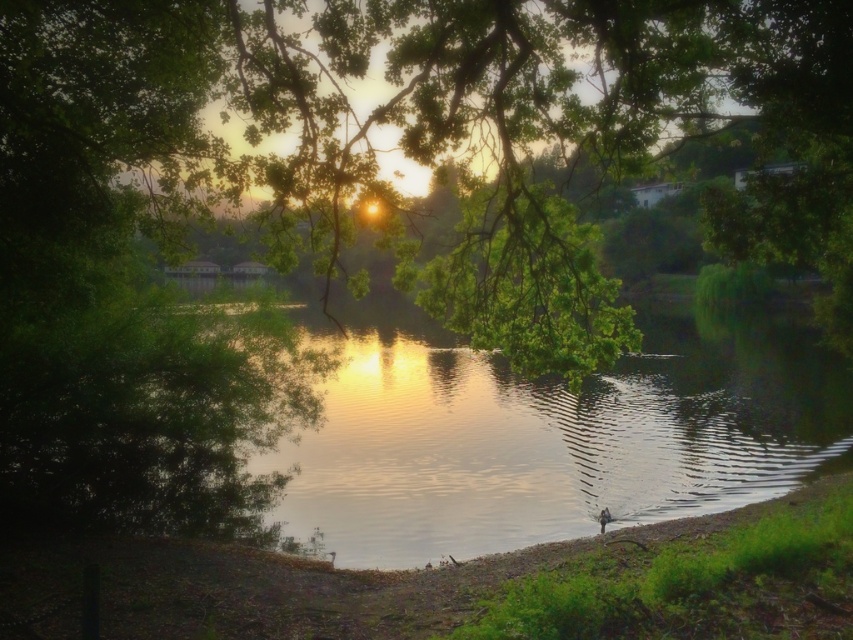
Question: Which object is closer to the camera taking this photo?

Choices:
 (A) dull brown dirt at lower center
 (B) green reflective water at center

Answer: (A)

Question: In this image, where is green reflective water at center located relative to dull brown dirt at lower center?

Choices:
 (A) above
 (B) below

Answer: (A)

Question: Is green reflective water at center wider than dull brown dirt at lower center?

Choices:
 (A) yes
 (B) no

Answer: (A)

Question: Does green reflective water at center lie behind dull brown dirt at lower center?

Choices:
 (A) no
 (B) yes

Answer: (B)